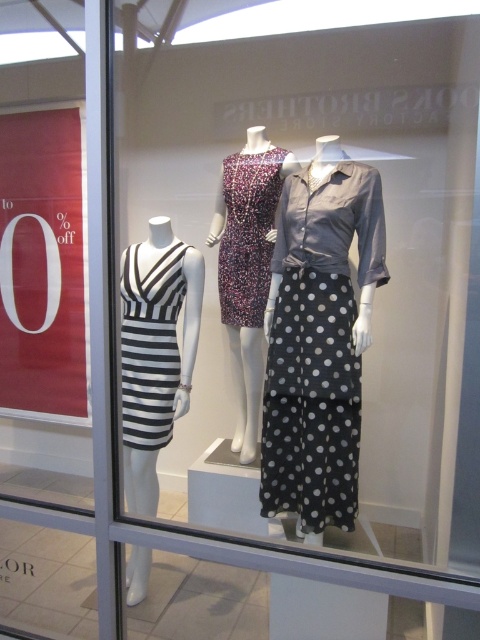
From the picture: Which is more to the right, black and white striped dress at left or sparkly purple dress at center?

From the viewer's perspective, sparkly purple dress at center appears more on the right side.

Is point (152, 458) farther from viewer compared to point (244, 211)?

No, (152, 458) is in front of (244, 211).

Does point (132, 289) come farther from viewer compared to point (269, 198)?

That is False.

What are the coordinates of `black and white striped dress at left` in the screenshot? It's located at (156, 353).

Who is lower down, printed fabric dress at center or sparkly purple dress at center?

Positioned lower is printed fabric dress at center.

Is printed fabric dress at center bigger than sparkly purple dress at center?

Yes.

This screenshot has width=480, height=640. I want to click on printed fabric dress at center, so click(x=247, y=266).

Does gray polka dot skirt at center have a larger size compared to sparkly purple dress at center?

Yes, gray polka dot skirt at center is bigger than sparkly purple dress at center.

Does gray polka dot skirt at center appear on the right side of sparkly purple dress at center?

Correct, you'll find gray polka dot skirt at center to the right of sparkly purple dress at center.

Is point (374, 268) in front of point (252, 292)?

Yes, it is.

Find the location of a particular element. The width and height of the screenshot is (480, 640). gray polka dot skirt at center is located at coordinates (317, 344).